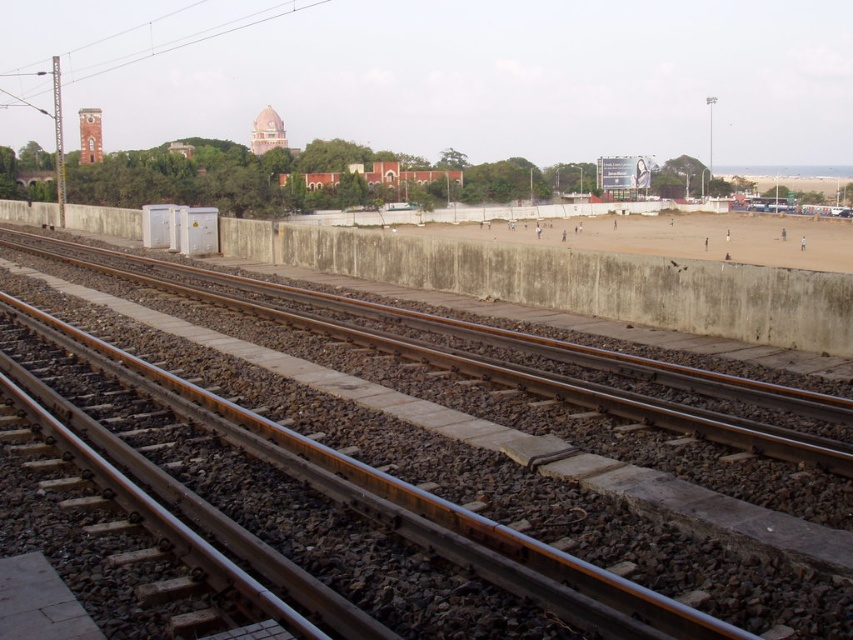
You are standing at the edge of the brown sandy beach at center and looking towards the metal at left. Which object is closer to you?

The metal at left is closer to you because it is in front of the brown sandy beach at center.

You are standing at the origin point of the image coordinate system, which is the bottom left corner. You want to place a new sensor at the position of metal at left. What are the coordinates where you should place the sensor?

The coordinates for the metal at left are at point (433,497), so you should place the sensor at those coordinates.